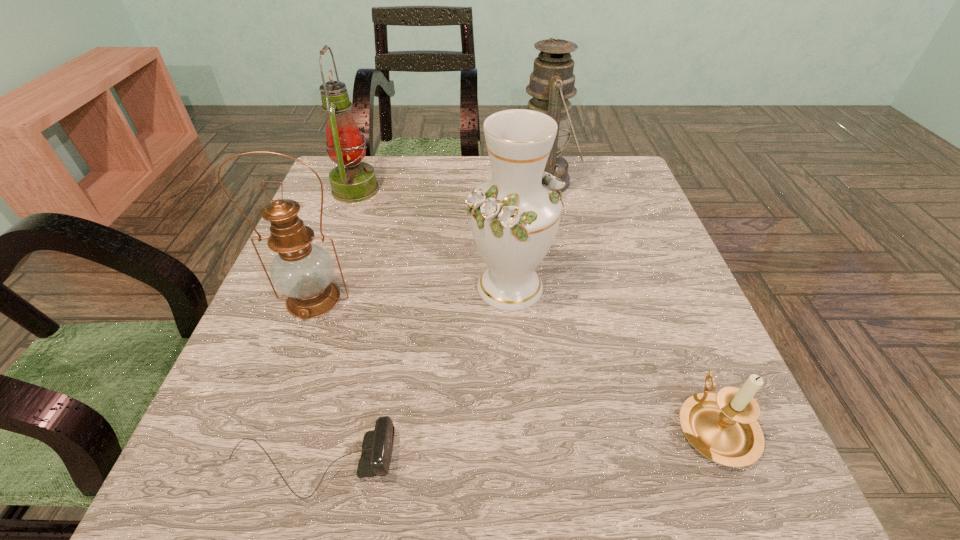
Locate an element on the screen. Image resolution: width=960 pixels, height=540 pixels. object that is the fifth closest to the webcam is located at coordinates (552, 81).

Locate an element on the screen. object identified as the second closest to the rightmost oil lamp is located at coordinates (352, 181).

Identify which oil lamp is the third nearest to the shortest object. Please provide its 2D coordinates. Your answer should be formatted as a tuple, i.e. [(x, y)], where the tuple contains the x and y coordinates of a point satisfying the conditions above.

[(552, 81)]

This screenshot has width=960, height=540. In order to click on the closest oil lamp to the nearest oil lamp in this screenshot , I will do `click(352, 181)`.

This screenshot has width=960, height=540. What are the coordinates of `vacant space that satisfies the following two spatial constraints: 1. on the back side of the vase; 2. on the right side of the nearest oil lamp` in the screenshot? It's located at (318, 287).